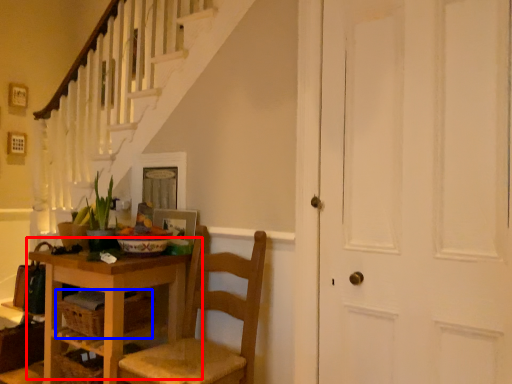
Question: Which object appears farthest to the camera in this image, table (highlighted by a red box) or drawer (highlighted by a blue box)?

Choices:
 (A) table
 (B) drawer

Answer: (B)